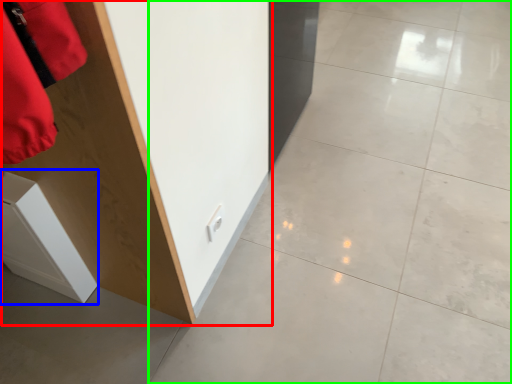
Question: Estimate the real-world distances between objects in this image. Which object is closer to furniture (highlighted by a red box), cabinetry (highlighted by a blue box) or concrete (highlighted by a green box)?

Choices:
 (A) cabinetry
 (B) concrete

Answer: (A)